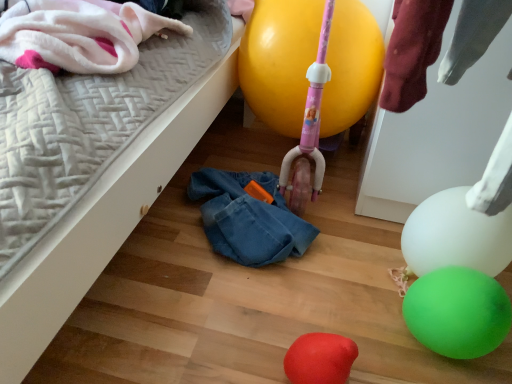
Question: Is yellow rubber balloon at center, the 4th balloon from the bottom, wider or thinner than fluffy white blanket at upper left?

Choices:
 (A) wide
 (B) thin

Answer: (B)

Question: Considering the positions of yellow rubber balloon at center, the 1th balloon viewed from the top, and fluffy white blanket at upper left in the image, is yellow rubber balloon at center, the 1th balloon viewed from the top, bigger or smaller than fluffy white blanket at upper left?

Choices:
 (A) small
 (B) big

Answer: (A)

Question: Estimate the real-world distances between objects in this image. Which object is closer to the green rubber balloon at lower right, the third balloon in the top-to-bottom sequence?

Choices:
 (A) yellow rubber balloon at center, the 4th balloon from the bottom
 (B) fluffy white blanket at upper left
 (C) white glossy balloon at lower right, marked as the second balloon in a top-to-bottom arrangement
 (D) rubber balloon at lower center, the first balloon ordered from the bottom

Answer: (C)

Question: Estimate the real-world distances between objects in this image. Which object is farther from the fluffy white blanket at upper left?

Choices:
 (A) white glossy balloon at lower right, marked as the second balloon in a top-to-bottom arrangement
 (B) yellow rubber balloon at center, the 4th balloon from the bottom
 (C) rubber balloon at lower center, which is the fourth balloon from top to bottom
 (D) green rubber balloon at lower right, the third balloon in the top-to-bottom sequence

Answer: (D)